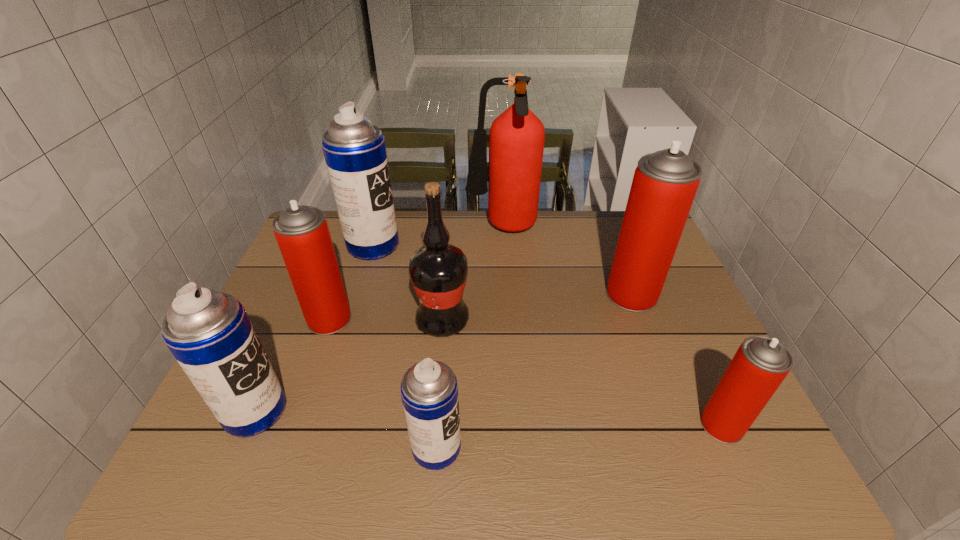
What are the coordinates of `fire extinguisher located in the far edge section of the desktop` in the screenshot? It's located at (516, 139).

Find the location of a particular element. The width and height of the screenshot is (960, 540). aerosol can positioned at the far edge is located at coordinates (354, 149).

In order to click on object located at the far left corner in this screenshot , I will do `click(354, 149)`.

Find the location of a particular element. Image resolution: width=960 pixels, height=540 pixels. object positioned at the near left corner is located at coordinates (209, 333).

Find the location of a particular element. Image resolution: width=960 pixels, height=540 pixels. object that is at the near right corner is located at coordinates (760, 365).

Find the location of a particular element. Image resolution: width=960 pixels, height=540 pixels. vacant area at the far edge is located at coordinates (570, 239).

In the image, there is a desktop. Where is `vacant space at the near edge`? The image size is (960, 540). vacant space at the near edge is located at coordinates (290, 443).

Identify the location of free spot at the left edge of the desktop. (285, 350).

Identify the location of vacant region at the right edge of the desktop. This screenshot has width=960, height=540. (664, 289).

This screenshot has height=540, width=960. In order to click on vacant space at the far right corner in this screenshot , I will do `click(610, 221)`.